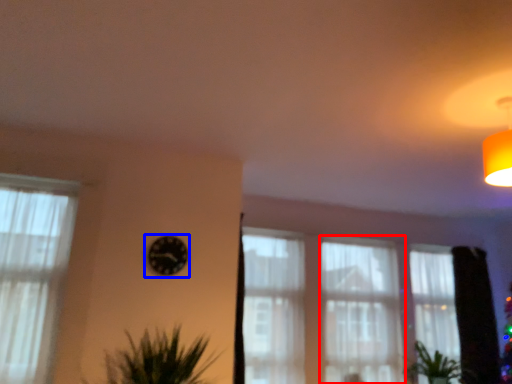
Question: Which point is closer to the camera, curtain (highlighted by a red box) or clock (highlighted by a blue box)?

Choices:
 (A) curtain
 (B) clock

Answer: (B)